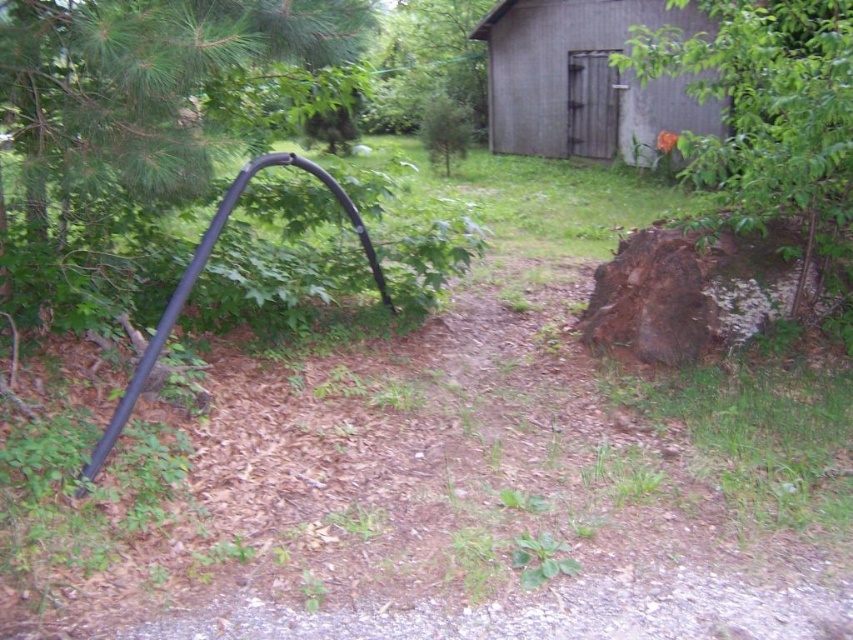
You are standing at the camera position and want to place a 2 meter long ladder between the black curved pipe and the rough bark tree stump at right. Is there enough space between them to fit the ladder horizontally?

The distance between the rough bark tree stump at right and the camera is 3.72 meters. However, the question involves the space between the black curved pipe and the tree stump. Since the pipe curves from the left towards the center, the distance between the pipe and the stump isn not directly provided. Thus, it is impossible to determine if the ladder would fit without additional information about their separation.